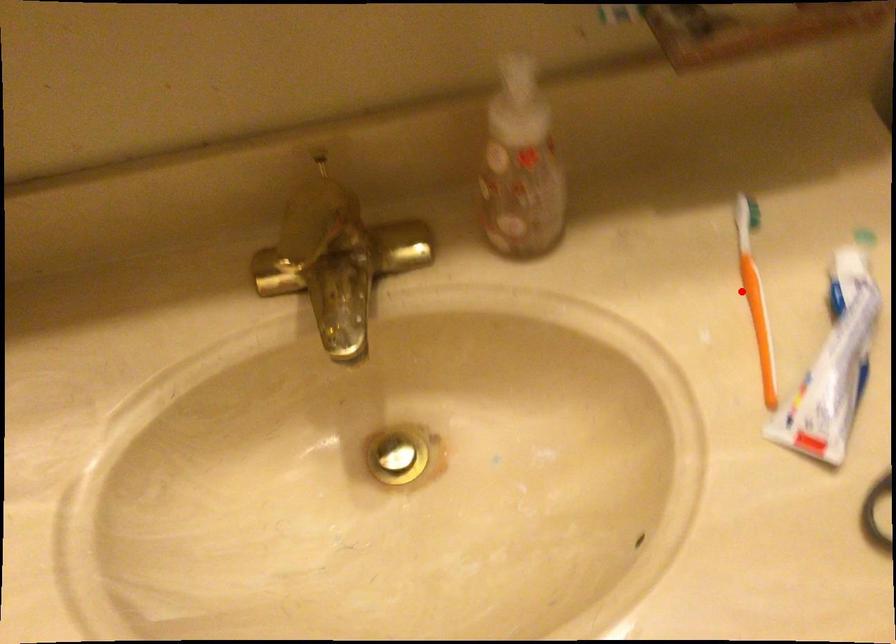
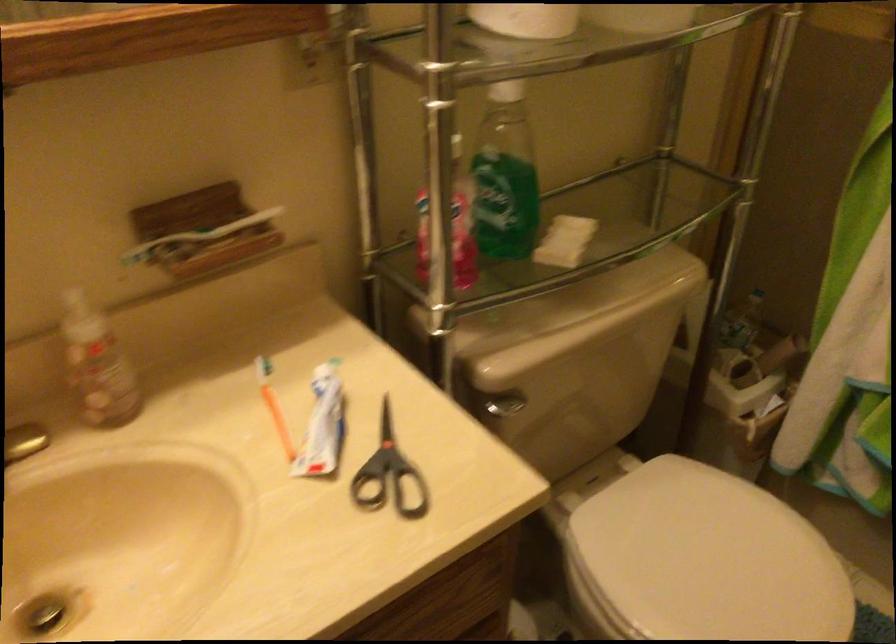
Find the pixel in the second image that matches the highlighted location in the first image.

(272, 406)